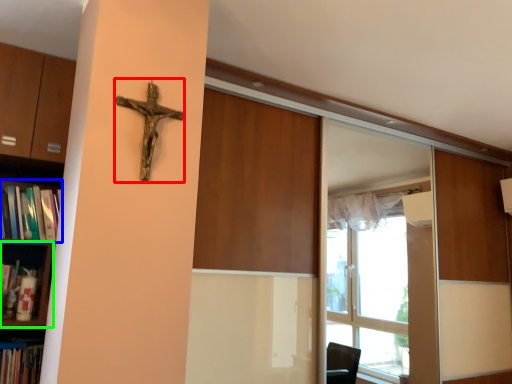
Question: Which object is positioned closest to crucifix (highlighted by a red box)? Select from book (highlighted by a blue box) and shelf (highlighted by a green box).

Choices:
 (A) book
 (B) shelf

Answer: (A)